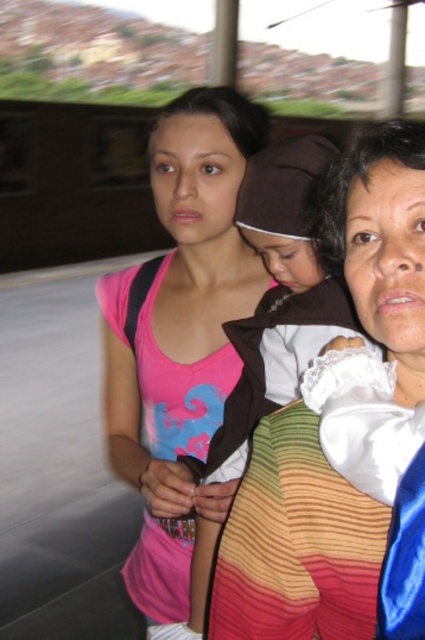
Consider the image. You are a photographer trying to capture a photo of the pink fabric at center and the white lace baby at center. The camera can only focus on objects wider than 30 cm. Can both objects be in focus?

The pink fabric at center is wider than the white lace baby at center. However, since the camera requires objects wider than 30 cm to be in focus, we need to know their exact widths. The description only states the pink fabric is wider but doesn

You are standing at point (x=263, y=252) and want to walk to point (x=152, y=497). Based on the scene, will you be moving towards the background or the foreground?

Since point (x=152, y=497) is behind point (x=263, y=252), you will be moving towards the background.

You are a photographer trying to capture a candid shot of the pink fabric at center and the white lace baby at center. Based on their positions, which object should you focus on first to ensure both are in frame?

The pink fabric at center has a greater height compared to the white lace baby at center, so you should focus on the pink fabric at center first to ensure both are in frame.